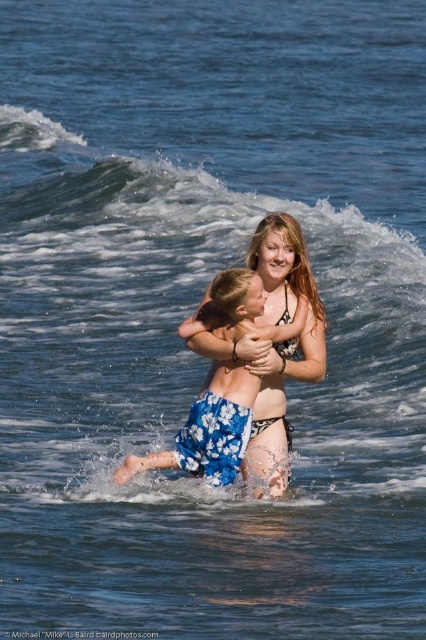
Question: Is white foamy wave at upper center wider than blue floral shorts at center?

Choices:
 (A) yes
 (B) no

Answer: (A)

Question: Can you confirm if white foamy wave at upper center is thinner than blue floral shorts at center?

Choices:
 (A) no
 (B) yes

Answer: (A)

Question: Does white foamy wave at upper center appear under blue floral shorts at center?

Choices:
 (A) yes
 (B) no

Answer: (B)

Question: Among these objects, which one is farthest from the camera?

Choices:
 (A) white foamy wave at upper center
 (B) blue floral shorts at center

Answer: (A)

Question: Which point is farther to the camera?

Choices:
 (A) (192, 417)
 (B) (173, 237)

Answer: (B)

Question: Which point is farther to the camera?

Choices:
 (A) (155, 452)
 (B) (186, 289)

Answer: (B)